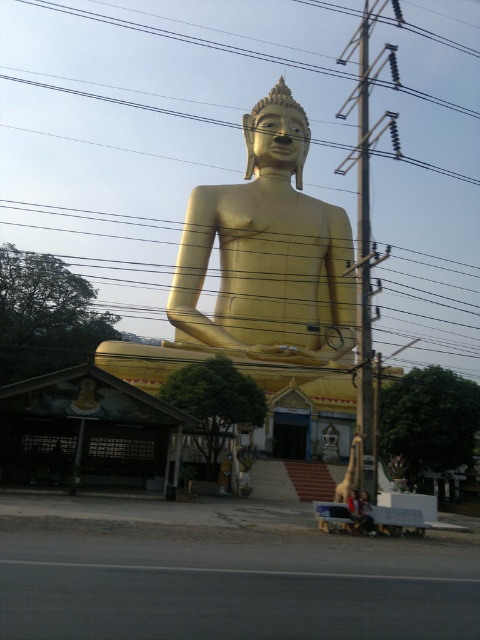
You are a visitor standing at the entrance of the temple complex. You see the black wire at upper center and the matte gold statue at center. Which object is positioned to the left of the other?

The black wire at upper center is positioned to the left of the matte gold statue at center.

Based on the photo, you are standing at the entrance of the temple complex and see the golden Buddha statue. There is a black wire marked by point (x=151, y=125) in the image. Where is the black wire located relative to the golden Buddha statue?

The black wire at upper center is represented by point (x=151, y=125), so it is located above and in the central area relative to the golden Buddha statue.

You are a photographer planning to take a picture of the golden Buddha statue. You notice a black wire at upper center in the frame. Based on its coordinates, will the wire appear in the center of the photo or off to one side?

The black wire at upper center is located at coordinates point (151, 125), which places it slightly to the left of the center in the photo.